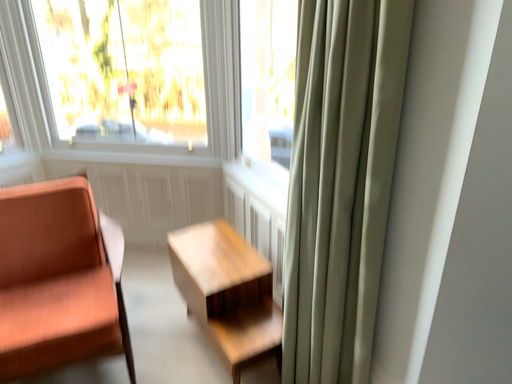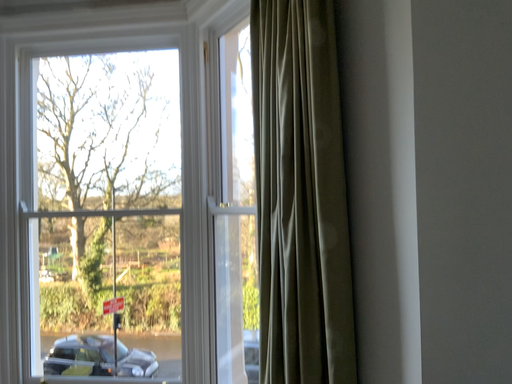
Question: Which way did the camera rotate in the video?

Choices:
 (A) rotated downward
 (B) rotated upward

Answer: (B)